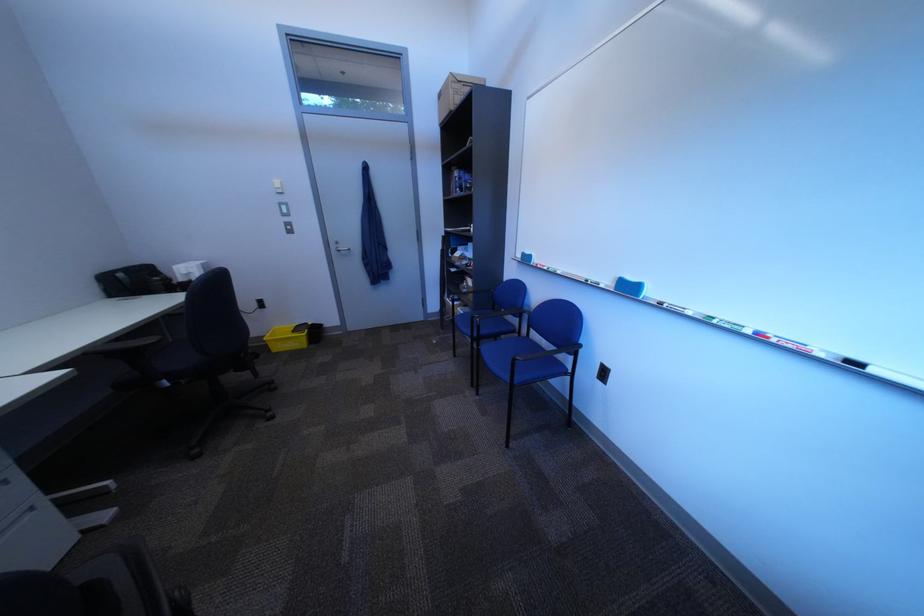
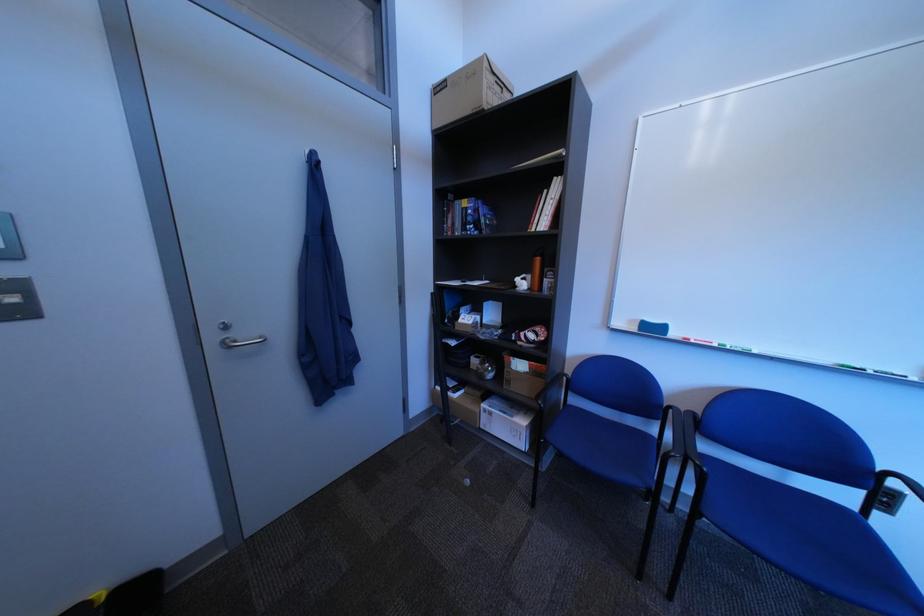
Find the pixel in the second image that matches the point at 348,248 in the first image.

(226, 339)